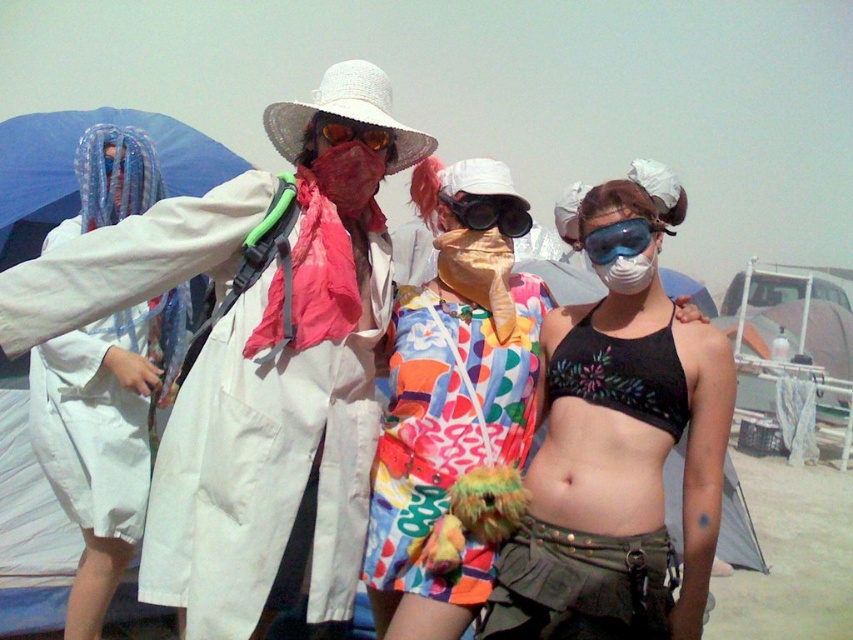
Between white cotton coat at center and transparent plastic goggles at center, which one has less height?

transparent plastic goggles at center

Between point (383, 296) and point (589, 250), which one is positioned behind?

The point (383, 296) is more distant.

Find the location of a particular element. This screenshot has height=640, width=853. white cotton coat at center is located at coordinates (285, 394).

At what (x,y) coordinates should I click in order to perform the action: click on white cotton coat at center. Please return your answer as a coordinate pair (x, y). The image size is (853, 640). Looking at the image, I should click on (285, 394).

Can you confirm if black embroidered bikini top at lower right is positioned below transparent plastic goggles at center?

Correct, black embroidered bikini top at lower right is located below transparent plastic goggles at center.

Find the location of a particular element. This screenshot has height=640, width=853. black embroidered bikini top at lower right is located at coordinates (619, 372).

Is floral fabric dress at center closer to the viewer compared to transparent plastic goggles at center?

Yes, it is.

Does floral fabric dress at center appear on the left side of transparent plastic goggles at center?

Correct, you'll find floral fabric dress at center to the left of transparent plastic goggles at center.

Identify the location of floral fabric dress at center. (451, 413).